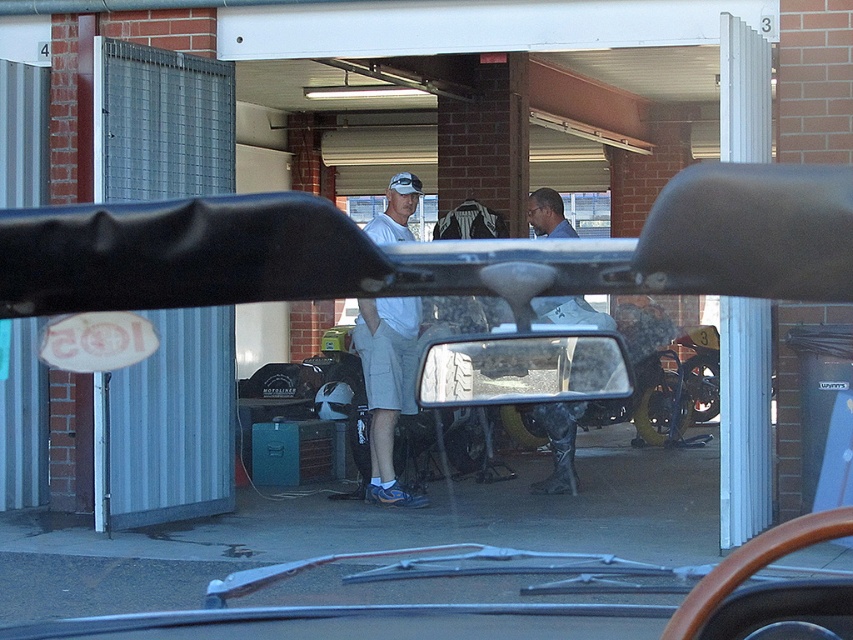
In the scene shown: You are a delivery driver who needs to load a package onto the matte black motorcycle at center. The package requires a space wider than the white matte baseball cap at center. Can the motorcycle provide enough width for the package?

The matte black motorcycle at center has a width larger than the white matte baseball cap at center, so it can accommodate the package requiring more space than the cap.

You are a passenger in the car and looking out the windshield. You see the white matte shorts at center and the dark gray rubber boots at center. Which one is higher up in the scene?

The white matte shorts at center is located above dark gray rubber rubber boots at center, so it is higher up in the scene.

You are driving a car and looking through the windshield. You see a matte black motorcycle at center and a white matte shorts at center. Which object is closer to you?

The matte black motorcycle at center is closer to you because it is positioned over the white matte shorts at center, indicating it is in a more forward plane in the visual field.